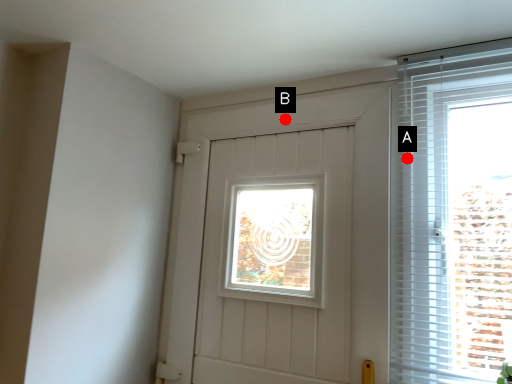
Question: Two points are circled on the image, labeled by A and B beside each circle. Among these points, which one is farthest from the camera?

Choices:
 (A) A is further
 (B) B is further

Answer: (B)